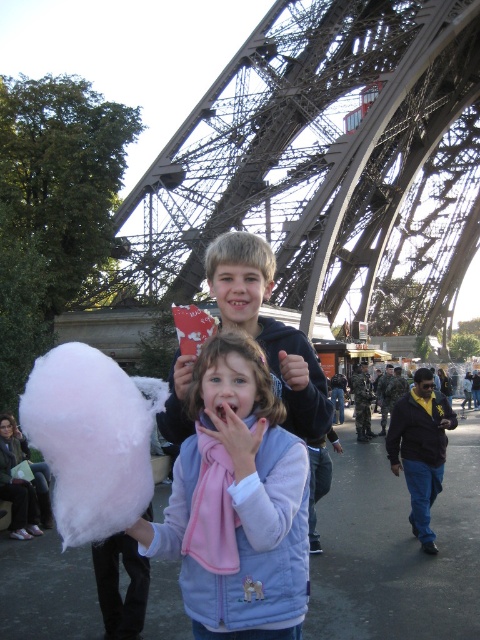
Is point (148, 492) closer to viewer compared to point (436, 467)?

Yes, point (148, 492) is closer to viewer.

Can you confirm if white fluffy cotton candy at lower left is bigger than dark blue jacket at center?

Yes, white fluffy cotton candy at lower left is bigger than dark blue jacket at center.

Between point (101, 401) and point (432, 444), which one is positioned in front?

Point (101, 401) is in front.

This screenshot has width=480, height=640. I want to click on white fluffy cotton candy at lower left, so click(x=92, y=438).

Does metallic structure at center appear under dark blue jacket at center?

Actually, metallic structure at center is above dark blue jacket at center.

Does metallic structure at center come in front of dark blue jacket at center?

No, it is not.

Who is more distant from viewer, (403, 0) or (432, 470)?

Point (403, 0)

You are a GUI agent. You are given a task and a screenshot of the screen. Output one action in this format:
    pyautogui.click(x=<x>, y=<y>)
    Task: Click on the metallic structure at center
    Image resolution: width=480 pixels, height=640 pixels.
    Given the screenshot: What is the action you would take?
    pyautogui.click(x=326, y=164)

Does point (434, 448) come in front of point (204, 564)?

No.

The height and width of the screenshot is (640, 480). Describe the element at coordinates (420, 449) in the screenshot. I see `dark blue jacket at center` at that location.

Is point (440, 474) closer to camera compared to point (264, 420)?

No, it is not.

The image size is (480, 640). What are the coordinates of `dark blue jacket at center` in the screenshot? It's located at (420, 449).